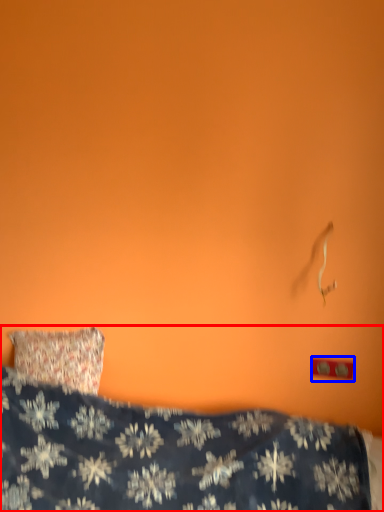
Question: Which object is further to the camera taking this photo, bed (highlighted by a red box) or electric outlet (highlighted by a blue box)?

Choices:
 (A) bed
 (B) electric outlet

Answer: (B)